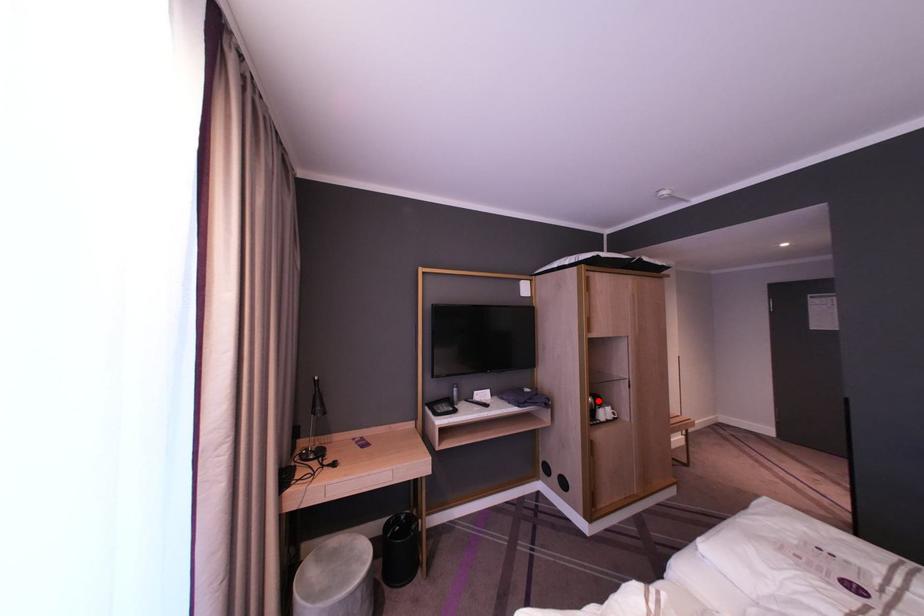
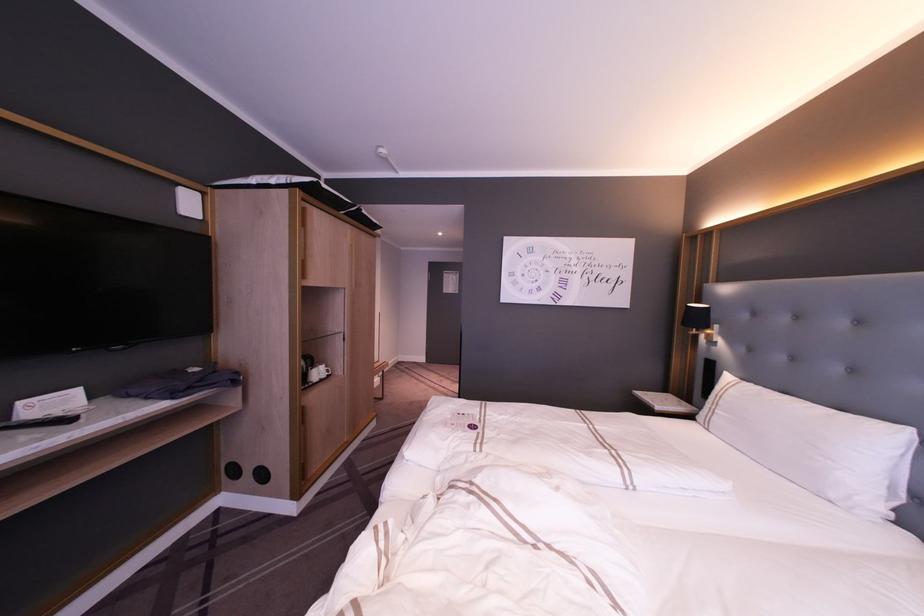
Question: I am providing you with two images of the same scene from different viewpoints. Given a red point in image1, look at the same physical point in image2. Is it:

Choices:
 (A) Closer to the viewpoint
 (B) Farther from the viewpoint

Answer: (A)